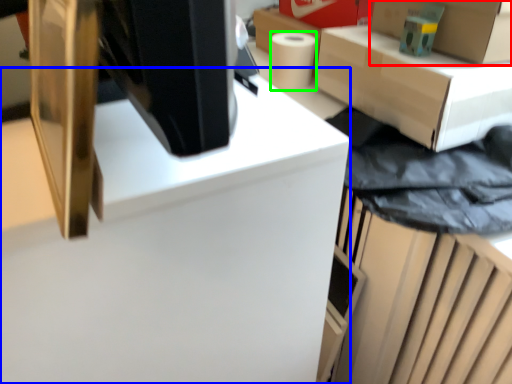
Question: Which is nearer to the box (highlighted by a red box)? computer desk (highlighted by a blue box) or paper towel (highlighted by a green box).

Choices:
 (A) computer desk
 (B) paper towel

Answer: (B)